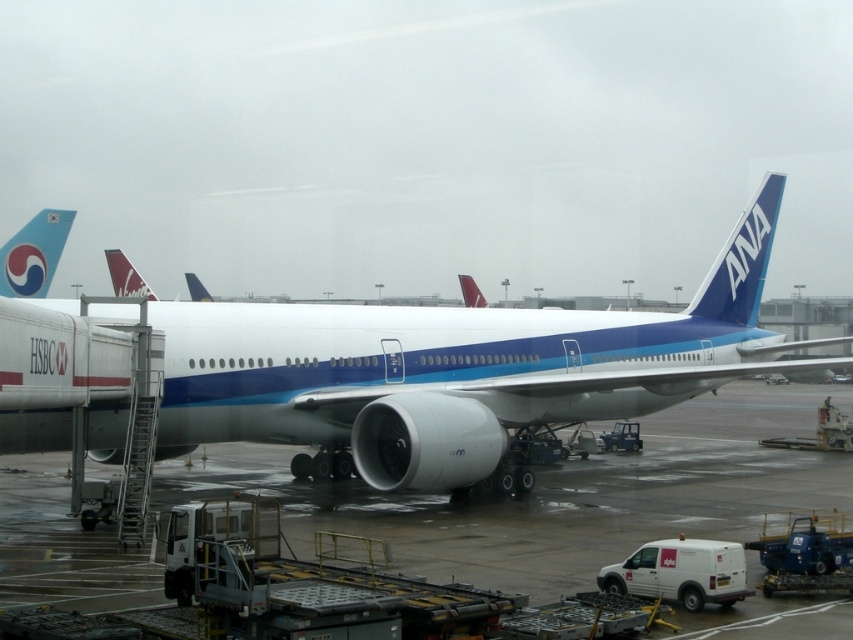
Question: Does white glossy airplane at center appear under smooth concrete tarmac at center?

Choices:
 (A) yes
 (B) no

Answer: (B)

Question: Considering the real-world distances, which object is farthest from the white glossy airplane at center?

Choices:
 (A) blue glossy tail fin at upper right
 (B) blue glossy tail at upper left
 (C) smooth concrete tarmac at center

Answer: (B)

Question: Which point is farther to the camera?

Choices:
 (A) pos(10,259)
 (B) pos(799,621)

Answer: (A)

Question: Does smooth concrete tarmac at center appear on the right side of blue glossy tail at upper left?

Choices:
 (A) no
 (B) yes

Answer: (B)

Question: Which point is farther to the camera?

Choices:
 (A) (190, 426)
 (B) (148, 572)
 (C) (734, 250)

Answer: (C)

Question: Does white glossy airplane at center have a smaller size compared to blue glossy tail at upper left?

Choices:
 (A) no
 (B) yes

Answer: (B)